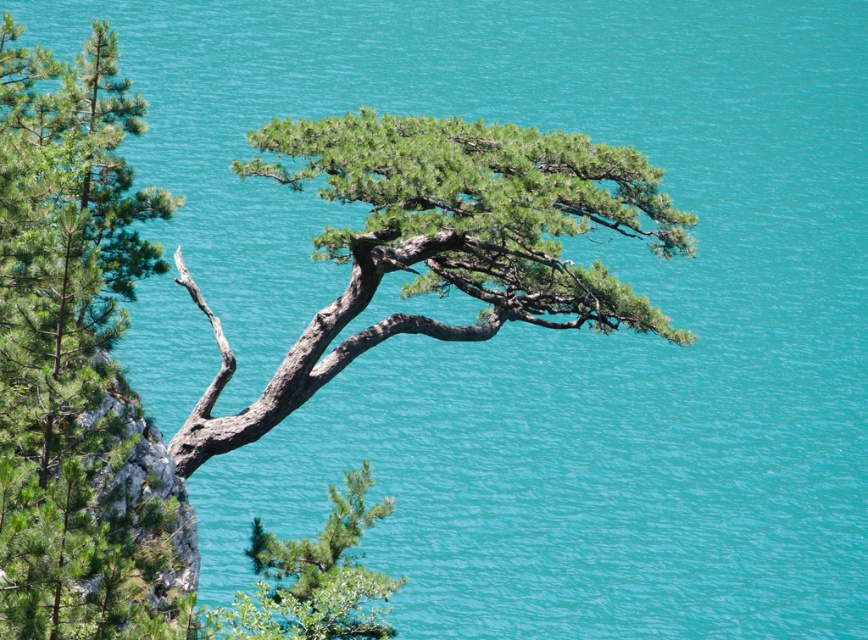
Is point (467, 252) less distant than point (326, 528)?

No, it is not.

Looking at this image, does green matte tree at center have a greater height compared to green matte tree at lower left?

Indeed, green matte tree at center has a greater height compared to green matte tree at lower left.

Describe the element at coordinates (444, 243) in the screenshot. I see `green matte tree at center` at that location.

I want to click on green matte tree at center, so click(x=444, y=243).

Does point (57, 541) come in front of point (340, 525)?

Yes, it is.

Measure the distance between point [91,381] and camera.

Point [91,381] and camera are 21.97 meters apart.

This screenshot has height=640, width=868. In order to click on green needle-like at left in this screenshot , I will do `click(70, 346)`.

Locate an element on the screen. The width and height of the screenshot is (868, 640). green needle-like at left is located at coordinates (70, 346).

Does green needle-like at left have a larger size compared to green matte tree at center?

Yes, green needle-like at left is bigger than green matte tree at center.

This screenshot has height=640, width=868. Describe the element at coordinates (70, 346) in the screenshot. I see `green needle-like at left` at that location.

You are a GUI agent. You are given a task and a screenshot of the screen. Output one action in this format:
    pyautogui.click(x=<x>, y=<y>)
    Task: Click on the green needle-like at left
    This screenshot has width=868, height=640.
    Given the screenshot: What is the action you would take?
    pyautogui.click(x=70, y=346)